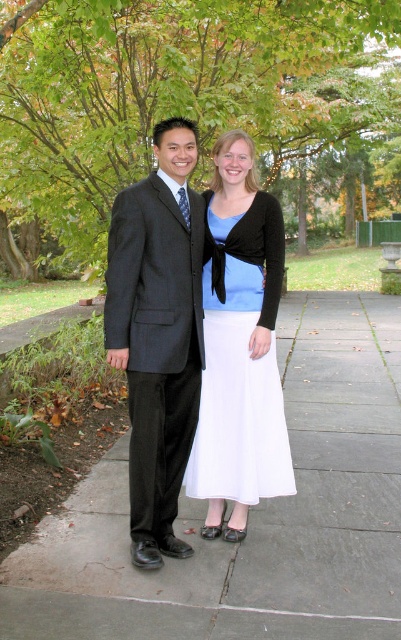
You are a photographer setting up a tripod to capture the two individuals standing on the gray concrete pavement at center and wearing the white satin dress at center. To ensure the dress is fully visible, where should you position the tripod relative to the pavement?

The gray concrete pavement at center has a lesser height compared to white satin dress at center, so positioning the tripod at the same level as the pavement will ensure the dress is fully visible without any obstruction.

You are a photographer setting up a shoot on the gray concrete pavement at center and the white satin dress at center. Which object should you place your camera closer to if you want to capture both subjects in the same frame without moving the camera?

You should place your camera closer to the gray concrete pavement at center because it is to the left of the white satin dress at center, allowing both to be in the same frame when positioned properly.